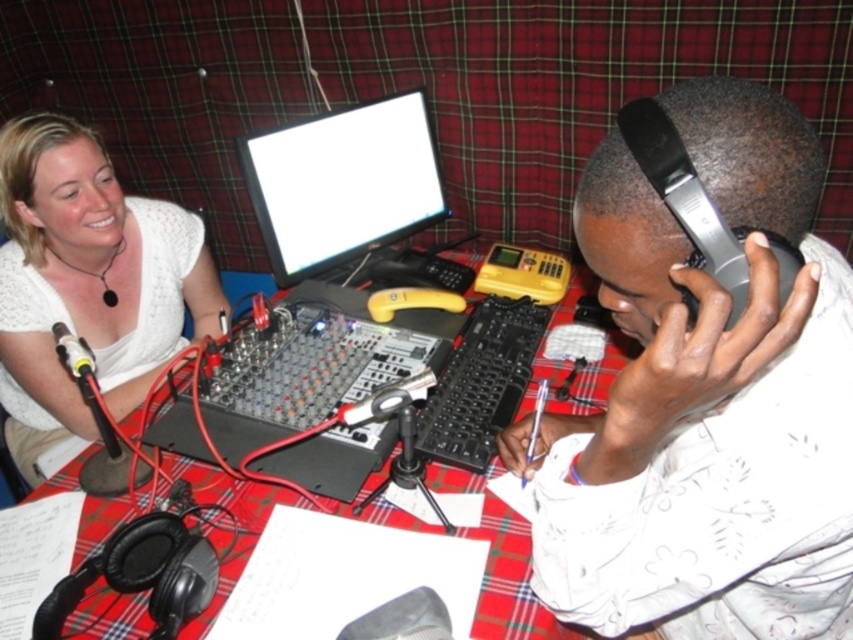
You are a sound technician needing to adjust the matte black headphones at right. If your arm can reach 20 inches, can you reach them without moving?

The matte black headphones at right are 19.45 inches away from the viewer, so yes, your arm can reach them since it can extend 20 inches.

You are setting up a live broadcast and need to place a 12 inch tall monitor between the white glossy computer screen at upper center and the red plaid table at center. Can you fit it vertically between them?

The white glossy computer screen at upper center is shorter than the red plaid table at center. Since the monitor is 12 inches tall, it can be placed vertically between them as there is sufficient vertical space between the two objects.

You are a sound engineer in the studio and need to adjust the headphones. Where are the matte black headphones at right in relation to the red plaid table at center?

The matte black headphones at right are located above the red plaid table at center.